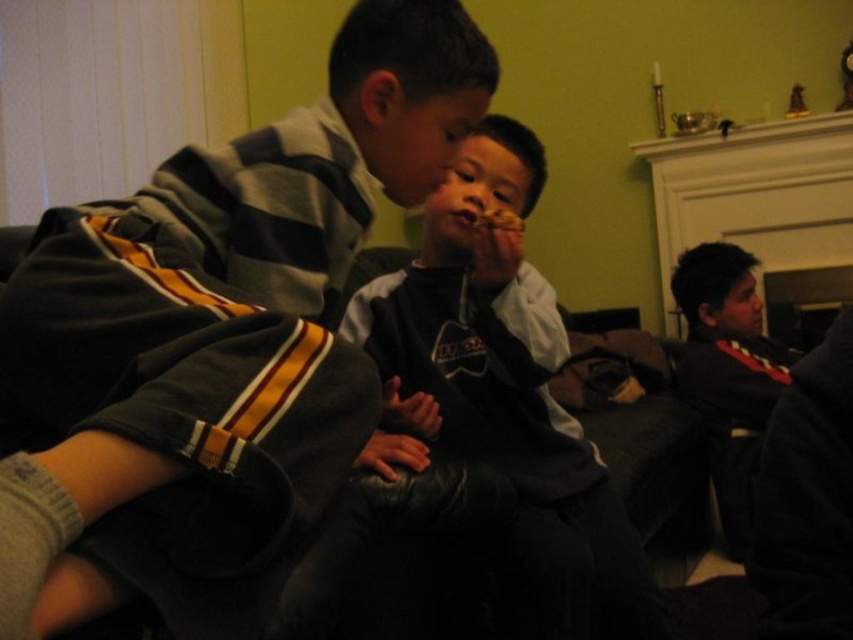
You are a photographer trying to capture a candid shot of the two boys on the couch. Since you want to focus on the matte gray hoodie at center, which is partially blocking the dark gray hoodie at center, which boy should you adjust your camera angle to emphasize more?

The matte gray hoodie at center is in front of the dark gray hoodie at center, so adjusting the camera angle to emphasize the matte gray hoodie at center would require focusing on the boy wearing it, as it is closer to the camera and blocking the view of the other.

You are a parent trying to hand a snack to your child sitting on the couch. The child is wearing a matte gray hoodie at center and there is a matte brown cookie at center nearby. Can you safely place the cookie within reach without it falling off the couch?

The matte gray hoodie at center and the matte brown cookie at center are 17.70 inches apart. Since the distance between them is sufficient, you can safely place the cookie within reach without it falling off the couch.

You are a parent trying to decide whether to place a small cookie jar on the table between the matte gray hoodie at center and the matte brown cookie at center. Considering their sizes, will the cookie jar fit comfortably between them?

The matte gray hoodie at center is larger than the matte brown cookie at center. Since the cookie jar is small, it should fit comfortably between them as there is enough space due to the hoodie taking up more room.